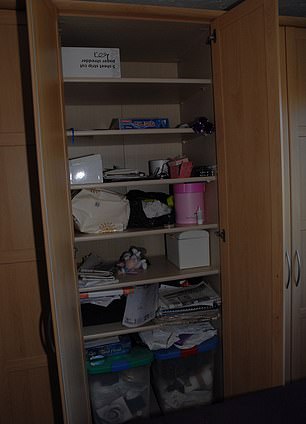
What are the coordinates of `cabinet handles` in the screenshot? It's located at (299, 271), (290, 271).